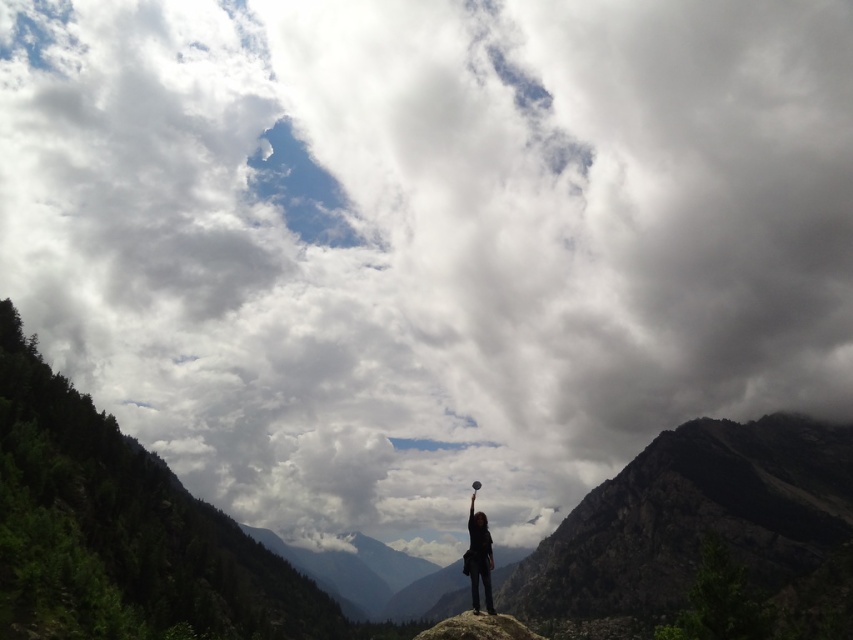
You are a hiker who wants to take a photo of the rugged stone mountain at center and the gray rock at center. Which object is closer to you?

The gray rock at center is closer to you because the rugged stone mountain at center is further away.

You are a photographer trying to capture the rugged stone mountain at center and the black fabric person at center in a single shot. Which object should you focus on first to ensure both are in focus?

The rugged stone mountain at center is further to the viewer than the black fabric person at center, so you should focus on the rugged stone mountain at center first to ensure both are in focus.

You are a photographer trying to capture the rugged stone mountain at center and the black fabric person at center in the same frame. Given that your camera has a maximum zoom range of 100 meters, can you fit both objects into the frame without moving your position?

The rugged stone mountain at center and the black fabric person at center are 220.09 meters apart from each other, which exceeds the camera maximum zoom range of 100 meters. Therefore, you cannot fit both objects into the frame without moving your position.